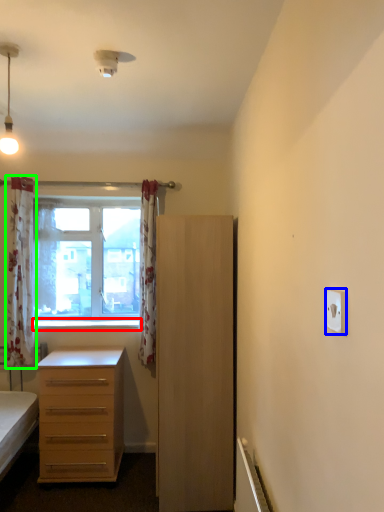
Question: Which object is positioned closest to window sill (highlighted by a red box)? Select from electric outlet (highlighted by a blue box) and curtain (highlighted by a green box).

Choices:
 (A) electric outlet
 (B) curtain

Answer: (B)